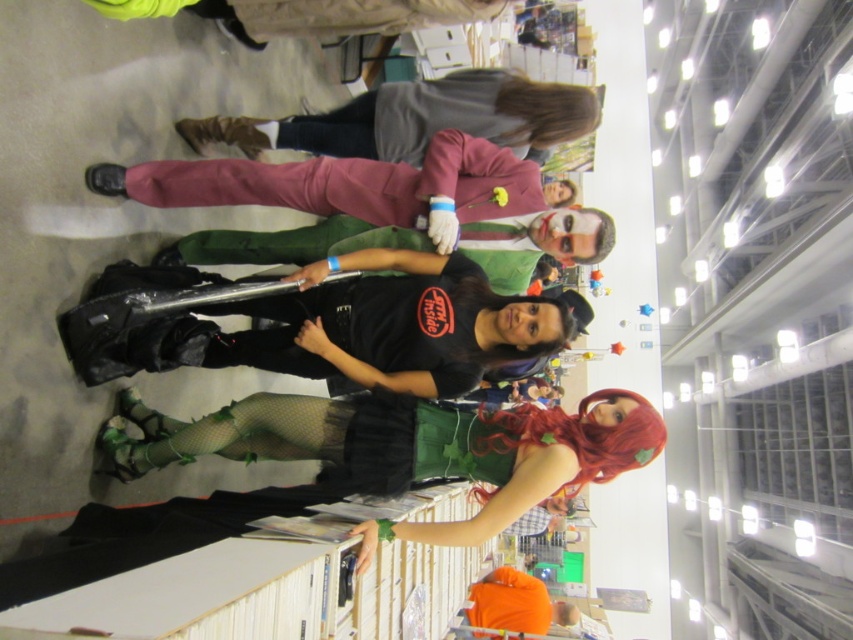
Question: Can you confirm if black matte t-shirt at center is smaller than matte gray sweater at upper center?

Choices:
 (A) no
 (B) yes

Answer: (B)

Question: Is black matte t-shirt at center above matte gray sweater at upper center?

Choices:
 (A) yes
 (B) no

Answer: (B)

Question: Among these points, which one is nearest to the camera?

Choices:
 (A) (416, 355)
 (B) (515, 84)
 (C) (650, 404)

Answer: (C)

Question: Is black matte t-shirt at center to the right of matte gray sweater at upper center from the viewer's perspective?

Choices:
 (A) yes
 (B) no

Answer: (B)

Question: Which of the following is the farthest from the observer?

Choices:
 (A) green mesh stockings at center
 (B) black matte t-shirt at center
 (C) matte gray sweater at upper center

Answer: (C)

Question: Which point appears farthest from the camera in this image?

Choices:
 (A) (402, 132)
 (B) (453, 308)

Answer: (A)